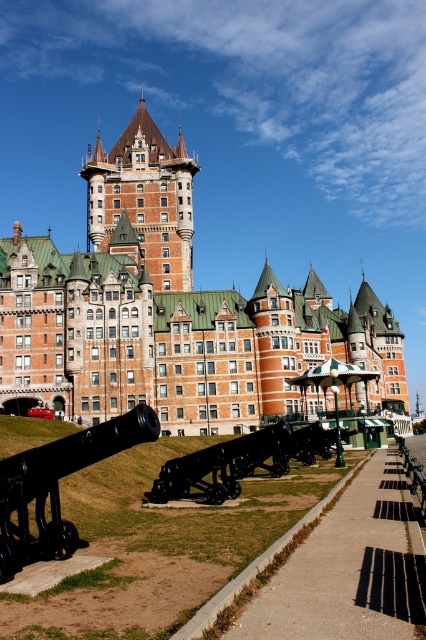
You are a tour guide explaining the historic site to visitors. You want to highlight the size difference between the orange brick tower at upper center and the black matte cannon at lower left. How would you describe their sizes in relation to each other?

The orange brick tower at upper center is larger in size than the black matte cannon at lower left, so the tower is significantly bigger and more imposing compared to the cannon.

You are standing at the point marked as point (x=172, y=314) in the image. What structure are you facing?

The point (x=172, y=314) indicates orange brick castle at center, so you are facing the orange brick castle at center.

You are standing in front of the historic building and want to take a photo that includes both the cannons and the building. You notice two points marked on your map corresponding to the coordinates point (x=46, y=314) and point (x=213, y=451). Which point should you stand closer to in order to ensure both the cannons and the building are in frame?

You should stand closer to point (x=46, y=314) because it is closer to you than point (x=213, y=451), allowing both the cannons and the building to be captured in the photo.